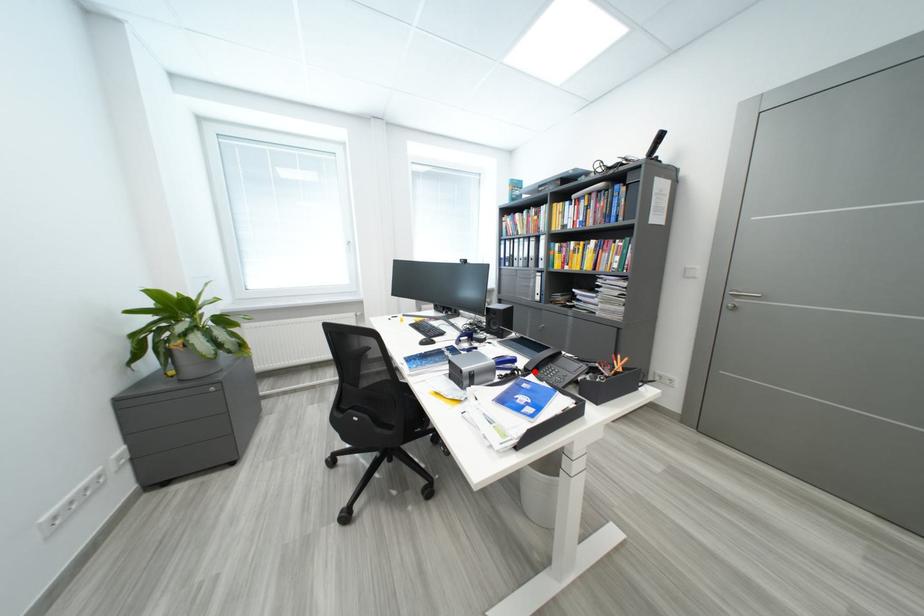
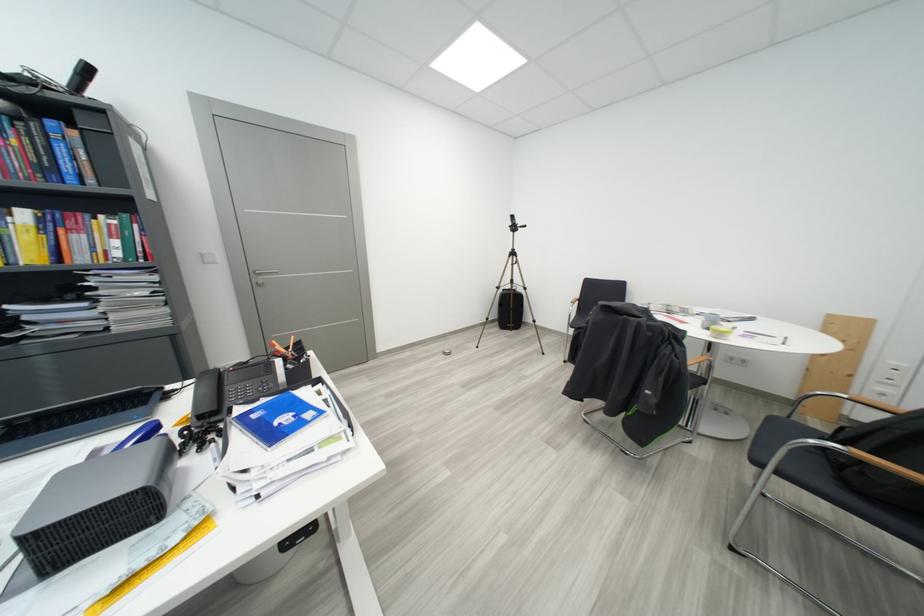
In the second image, find the point that corresponds to the highlighted location in the first image.

(209, 419)